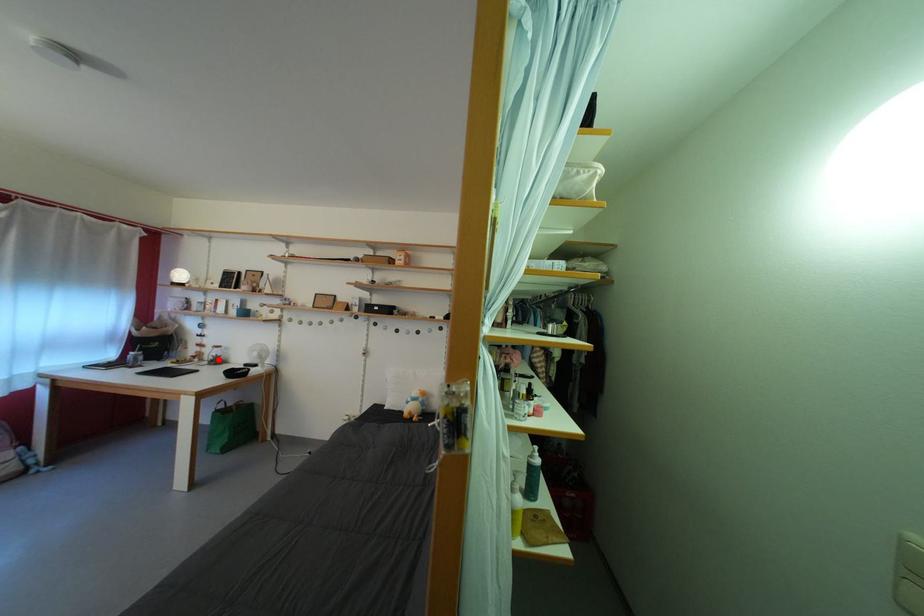
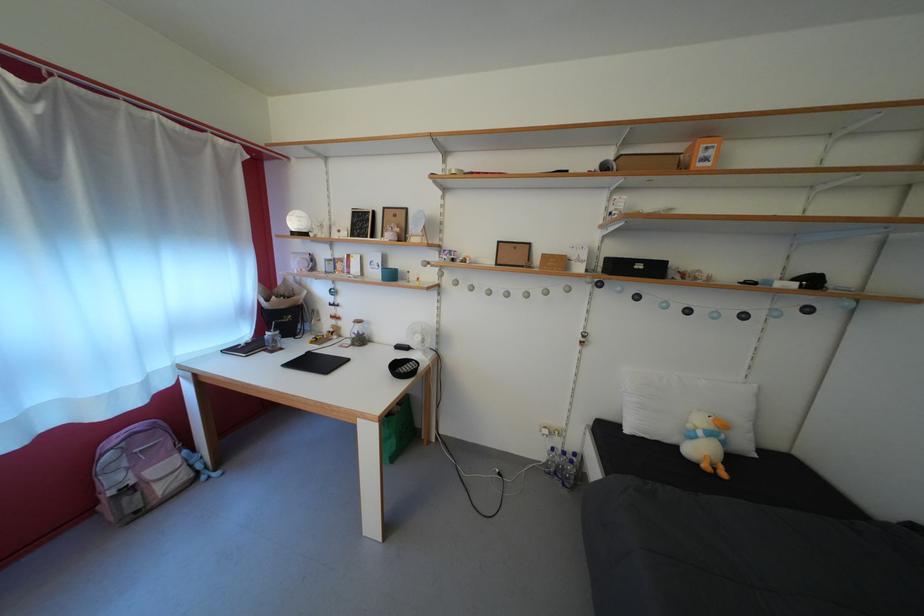
Question: I am providing you with two images of the same scene from different viewpoints. In image1, a red point is highlighted. Considering the same 3D point in image2, which of the following is correct?

Choices:
 (A) It is closer
 (B) It is farther

Answer: (B)